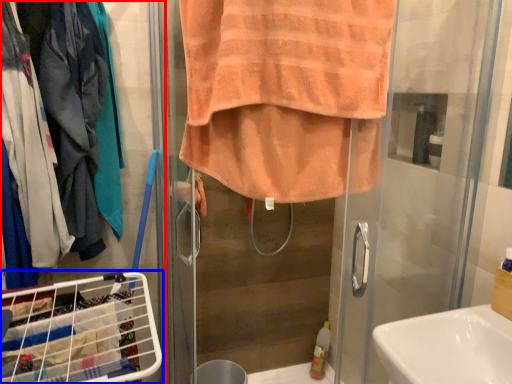
Question: Which of the following is the closest to the observer, closet (highlighted by a red box) or laundry basket (highlighted by a blue box)?

Choices:
 (A) closet
 (B) laundry basket

Answer: (B)